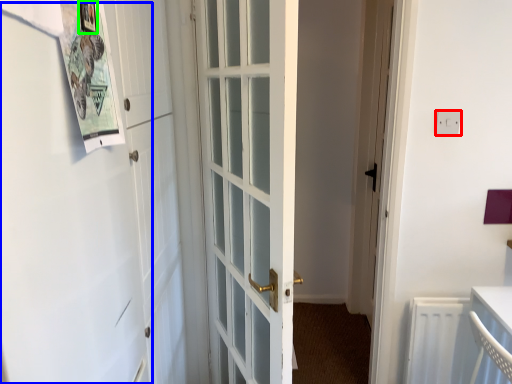
Question: Which object is the farthest from electric outlet (highlighted by a red box)? Choose among these: barn door (highlighted by a blue box) or picture frame (highlighted by a green box).

Choices:
 (A) barn door
 (B) picture frame

Answer: (A)